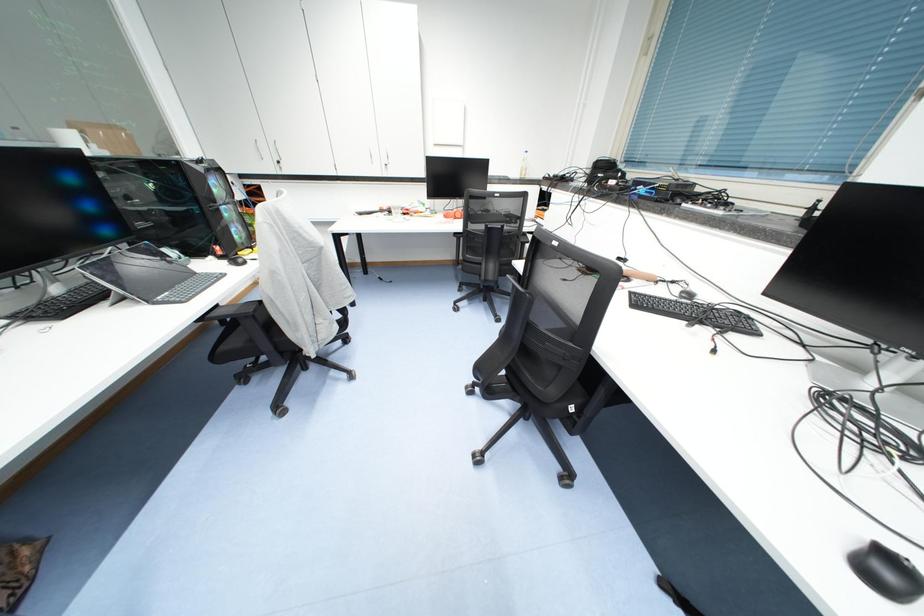
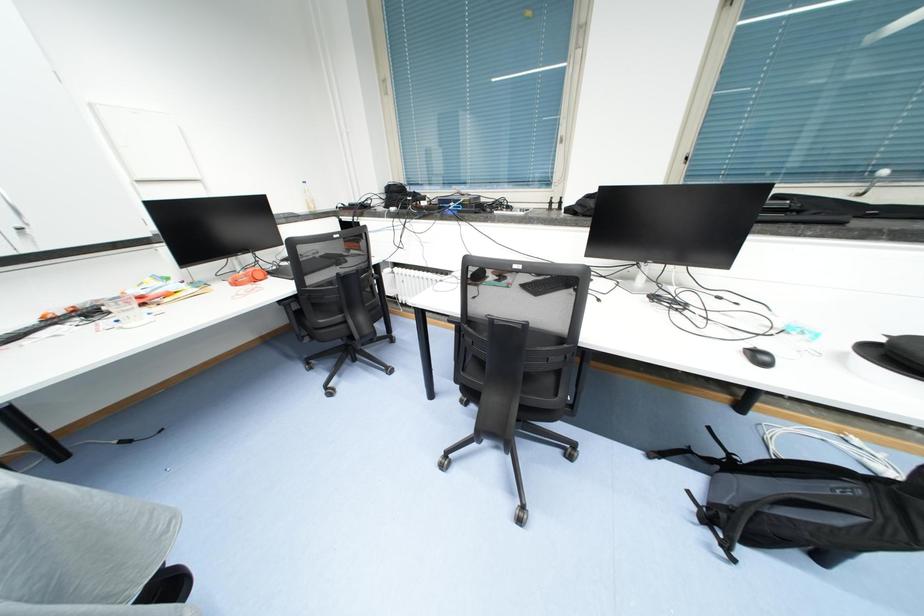
Question: Based on the continuous images, in which direction is the camera rotating? Reply with the corresponding letter.

Choices:
 (A) Left
 (B) Right
 (C) Up
 (D) Down

Answer: (B)